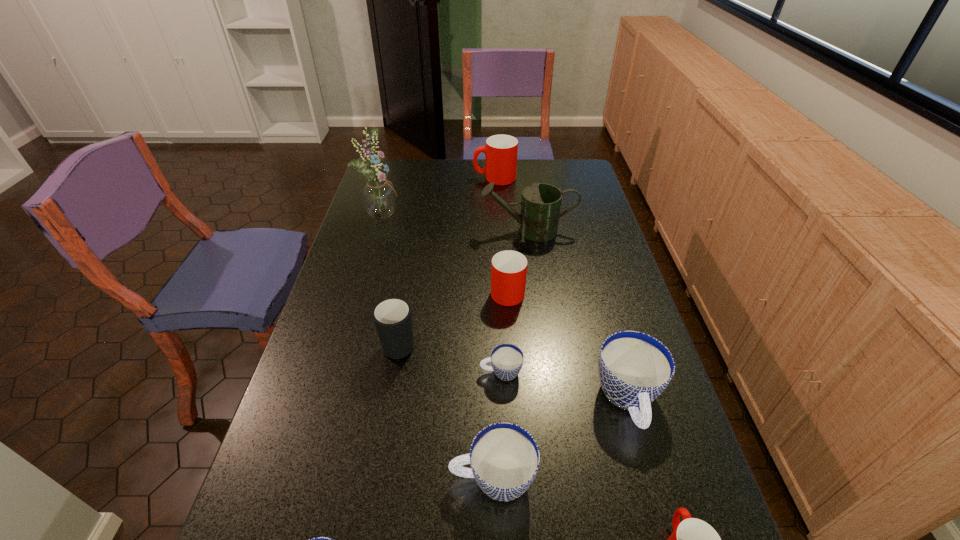
Where is `vacant space that satisfies the following two spatial constraints: 1. on the front-facing side of the green bouquet; 2. on the side of the mug with the handle`? vacant space that satisfies the following two spatial constraints: 1. on the front-facing side of the green bouquet; 2. on the side of the mug with the handle is located at coordinates (346, 342).